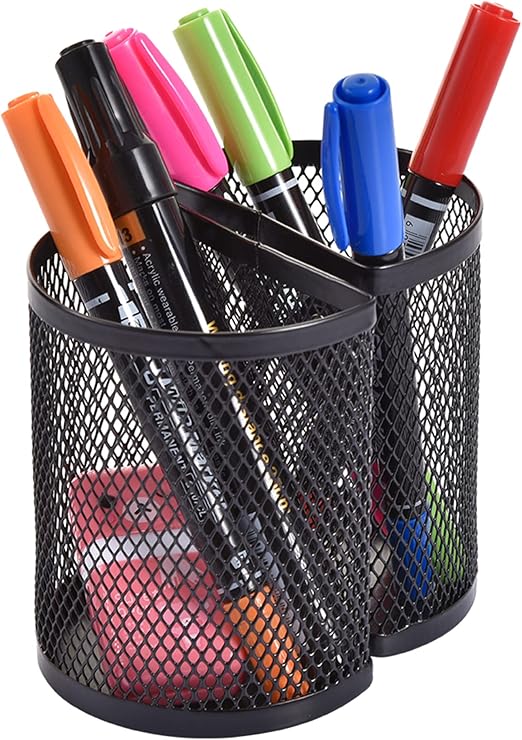
I want to click on markers, so click(440, 131), click(373, 144), click(225, 72), click(162, 89), click(117, 103), click(26, 152).